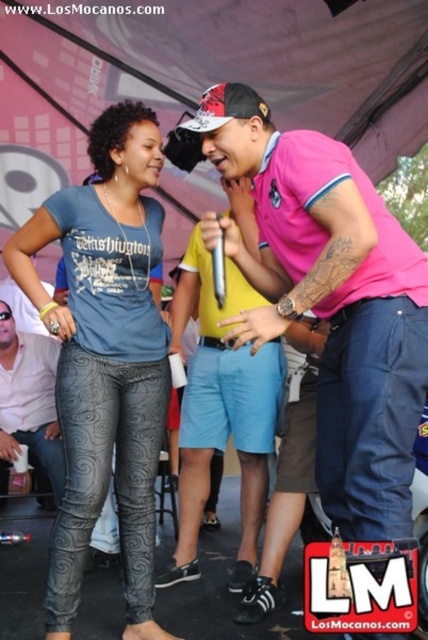
Who is more distant from viewer, (216,348) or (36,451)?

Point (36,451)

Which is in front, point (180, 262) or point (42, 435)?

Point (42, 435) is in front.

The image size is (428, 640). What do you see at coordinates (220, 412) in the screenshot? I see `matte yellow shirt at center` at bounding box center [220, 412].

Where is `matte yellow shirt at center`? Image resolution: width=428 pixels, height=640 pixels. matte yellow shirt at center is located at coordinates (220, 412).

Measure the distance from pink cotton shirt at center to metallic gray leggings at center.

They are 35.90 inches apart.

Is point (341, 500) more distant than point (53, 332)?

No, (341, 500) is in front of (53, 332).

Identify the location of pink cotton shirt at center. (327, 298).

Which of these two, pink cotton shirt at center or black textured leggings at center, stands taller?

pink cotton shirt at center

Who is more forward, (205, 140) or (128, 368)?

Positioned in front is point (205, 140).

Find the location of a particular element. pink cotton shirt at center is located at coordinates (327, 298).

Identify the location of pink cotton shirt at center. The height and width of the screenshot is (640, 428). (327, 298).